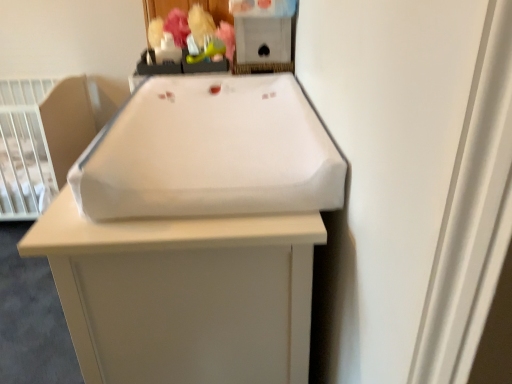
Question: From the image's perspective, is white plastic infant bed at left located beneath white fabric changing pad at center?

Choices:
 (A) no
 (B) yes

Answer: (A)

Question: Is white plastic infant bed at left wider than white fabric changing pad at center?

Choices:
 (A) no
 (B) yes

Answer: (B)

Question: From a real-world perspective, is white plastic infant bed at left on top of white fabric changing pad at center?

Choices:
 (A) yes
 (B) no

Answer: (B)

Question: Is white plastic infant bed at left taller than white fabric changing pad at center?

Choices:
 (A) yes
 (B) no

Answer: (B)

Question: Is white plastic infant bed at left behind white fabric changing pad at center?

Choices:
 (A) yes
 (B) no

Answer: (A)

Question: Is white plastic infant bed at left turned away from white fabric changing pad at center?

Choices:
 (A) yes
 (B) no

Answer: (B)

Question: Is white plastic infant bed at left oriented towards green rubber toy at upper center, acting as the first toy starting from the right?

Choices:
 (A) no
 (B) yes

Answer: (A)

Question: Is white plastic infant bed at left turned away from green rubber toy at upper center, the 2th toy viewed from the left?

Choices:
 (A) yes
 (B) no

Answer: (B)

Question: Does white plastic infant bed at left appear on the right side of green rubber toy at upper center, the 2th toy viewed from the left?

Choices:
 (A) no
 (B) yes

Answer: (A)

Question: Does white plastic infant bed at left touch green rubber toy at upper center, the 2th toy viewed from the left?

Choices:
 (A) yes
 (B) no

Answer: (B)

Question: From the image's perspective, does white plastic infant bed at left appear higher than green rubber toy at upper center, the 2th toy viewed from the left?

Choices:
 (A) no
 (B) yes

Answer: (A)

Question: Would you say white plastic infant bed at left contains green rubber toy at upper center, acting as the first toy starting from the right?

Choices:
 (A) no
 (B) yes

Answer: (A)

Question: Considering the relative sizes of matte plastic toy at upper center, arranged as the second toy when viewed from the right, and green rubber toy at upper center, the 2th toy viewed from the left, in the image provided, is matte plastic toy at upper center, arranged as the second toy when viewed from the right, shorter than green rubber toy at upper center, the 2th toy viewed from the left,?

Choices:
 (A) yes
 (B) no

Answer: (B)